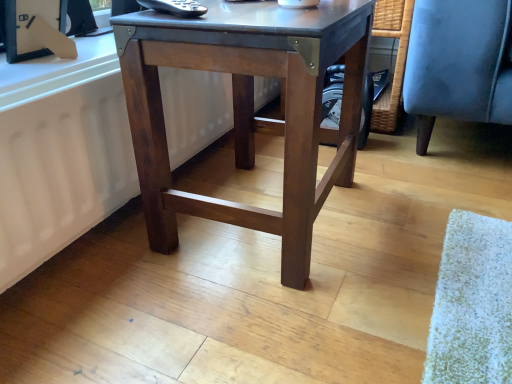
Question: From a real-world perspective, is white matte radiator at lower left on dark brown wood table at center?

Choices:
 (A) yes
 (B) no

Answer: (B)

Question: Does white matte radiator at lower left appear on the left side of dark brown wood table at center?

Choices:
 (A) no
 (B) yes

Answer: (B)

Question: Is white matte radiator at lower left looking in the opposite direction of dark brown wood table at center?

Choices:
 (A) yes
 (B) no

Answer: (B)

Question: From a real-world perspective, does white matte radiator at lower left sit lower than dark brown wood table at center?

Choices:
 (A) no
 (B) yes

Answer: (B)

Question: Considering the relative positions of white matte radiator at lower left and dark brown wood table at center in the image provided, is white matte radiator at lower left to the right of dark brown wood table at center from the viewer's perspective?

Choices:
 (A) no
 (B) yes

Answer: (A)

Question: Does white matte radiator at lower left turn towards dark brown wood table at center?

Choices:
 (A) no
 (B) yes

Answer: (B)

Question: From the image's perspective, does dark brown wood table at center appear lower than white matte radiator at lower left?

Choices:
 (A) yes
 (B) no

Answer: (B)

Question: Is dark brown wood table at center to the left of white matte radiator at lower left from the viewer's perspective?

Choices:
 (A) no
 (B) yes

Answer: (A)

Question: Can you confirm if dark brown wood table at center is wider than white matte radiator at lower left?

Choices:
 (A) no
 (B) yes

Answer: (B)

Question: Considering the relative sizes of dark brown wood table at center and white matte radiator at lower left in the image provided, is dark brown wood table at center bigger than white matte radiator at lower left?

Choices:
 (A) yes
 (B) no

Answer: (A)

Question: From a real-world perspective, is dark brown wood table at center positioned over white matte radiator at lower left based on gravity?

Choices:
 (A) yes
 (B) no

Answer: (A)

Question: Can you confirm if dark brown wood table at center is positioned to the right of white matte radiator at lower left?

Choices:
 (A) no
 (B) yes

Answer: (B)

Question: Considering the positions of dark brown wood table at center and white matte radiator at lower left in the image, is dark brown wood table at center wider or thinner than white matte radiator at lower left?

Choices:
 (A) thin
 (B) wide

Answer: (B)